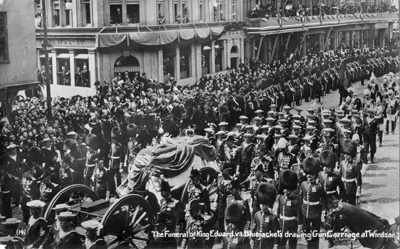
In order to click on cover in this screenshot , I will do `click(80, 56)`.